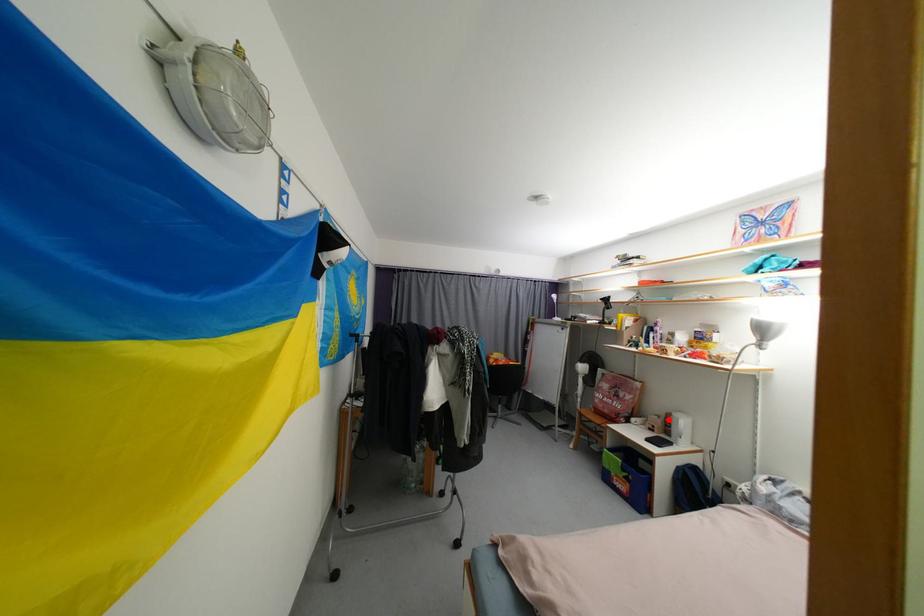
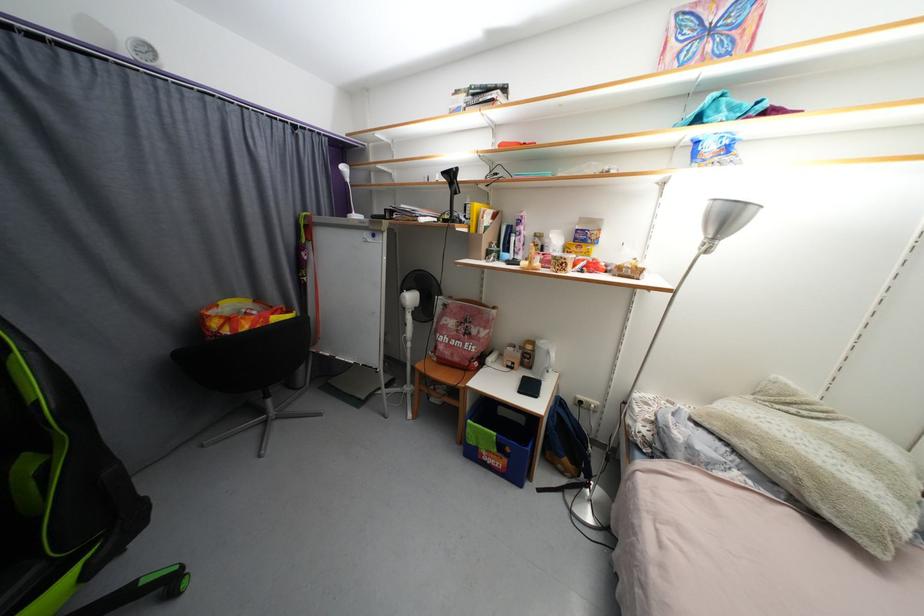
Question: I am providing you with two images of the same scene from different viewpoints. In image1, a red point is highlighted. Considering the same 3D point in image2, which of the following is correct?

Choices:
 (A) It is closer
 (B) It is farther

Answer: (B)